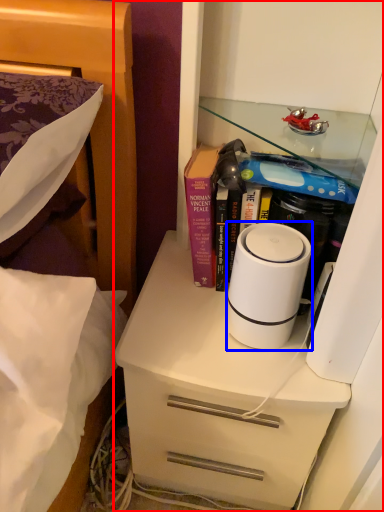
Question: Which object is closer to the camera taking this photo, cabinetry (highlighted by a red box) or home appliance (highlighted by a blue box)?

Choices:
 (A) cabinetry
 (B) home appliance

Answer: (A)